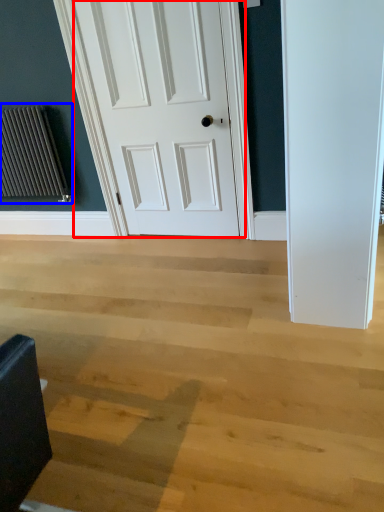
Question: Which object appears farthest to the camera in this image, door (highlighted by a red box) or radiator (highlighted by a blue box)?

Choices:
 (A) door
 (B) radiator

Answer: (B)